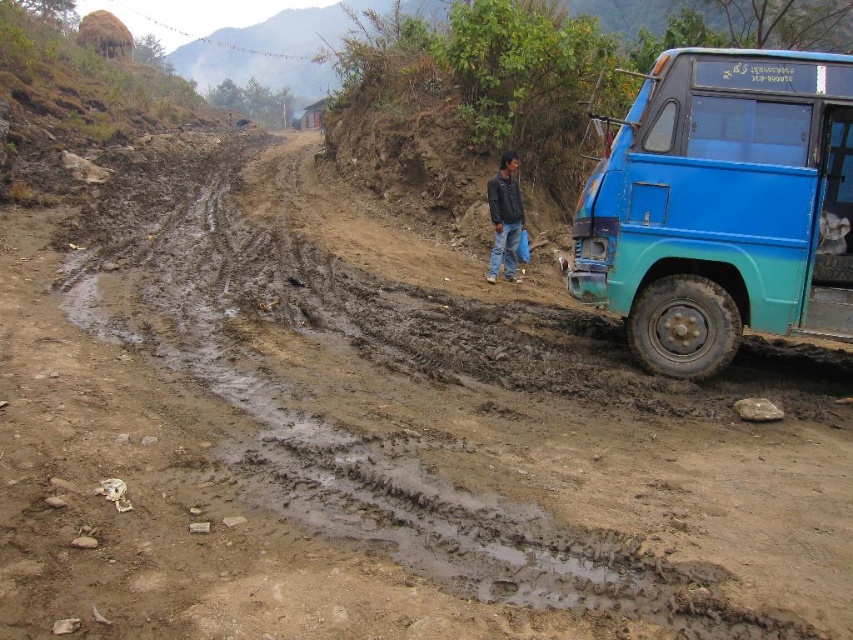
Question: Which point is closer to the camera taking this photo?

Choices:
 (A) (488, 189)
 (B) (764, 65)

Answer: (B)

Question: Among these points, which one is nearest to the camera?

Choices:
 (A) (515, 252)
 (B) (601, 179)

Answer: (B)

Question: Where is blue matte truck at right located in relation to black leather jacket at center in the image?

Choices:
 (A) left
 (B) right

Answer: (B)

Question: Does blue matte truck at right appear under black leather jacket at center?

Choices:
 (A) yes
 (B) no

Answer: (A)

Question: Which point is closer to the camera taking this photo?

Choices:
 (A) (505, 198)
 (B) (805, 262)

Answer: (B)

Question: Where is blue matte truck at right located in relation to black leather jacket at center in the image?

Choices:
 (A) below
 (B) above

Answer: (A)